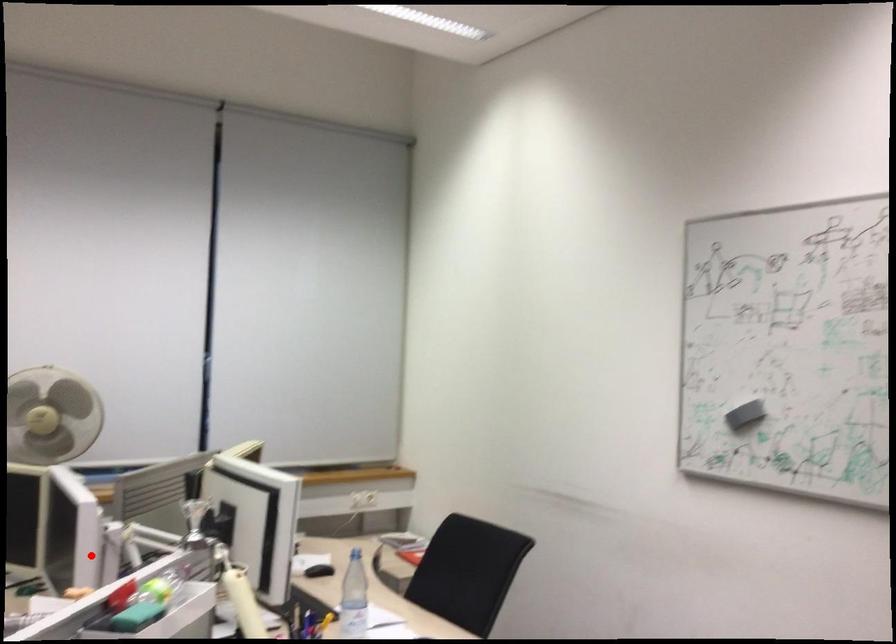
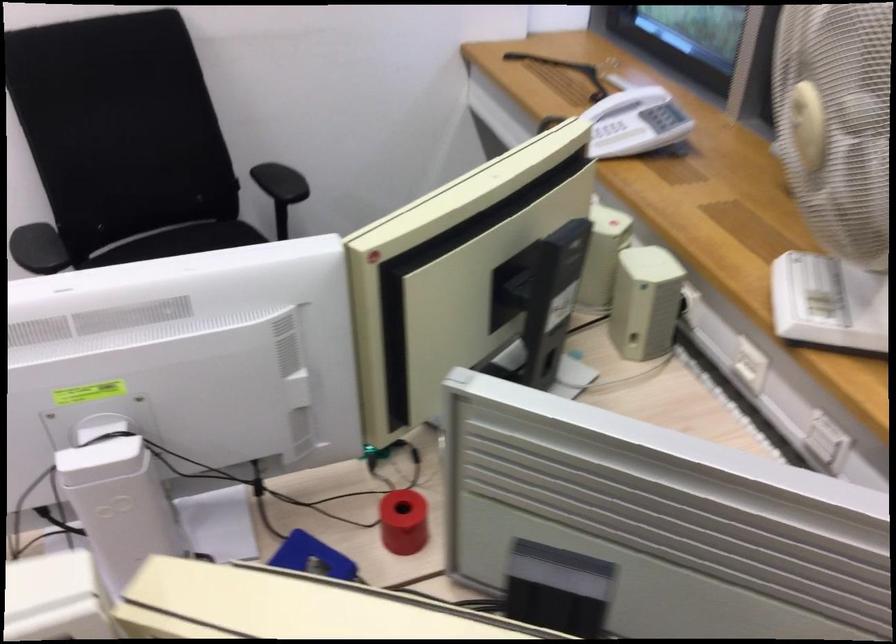
Where in the second image is the point corresponding to the highlighted location from the first image?

(118, 500)